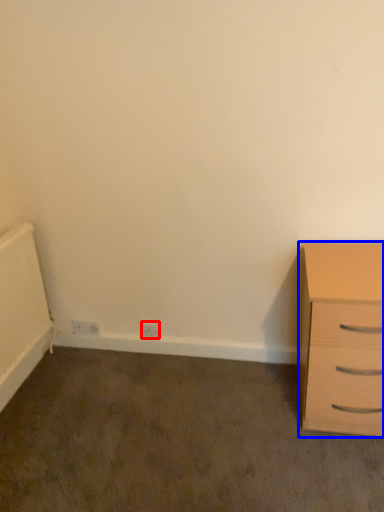
Question: Which of the following is the farthest to the observer, electric outlet (highlighted by a red box) or chest of drawers (highlighted by a blue box)?

Choices:
 (A) electric outlet
 (B) chest of drawers

Answer: (A)